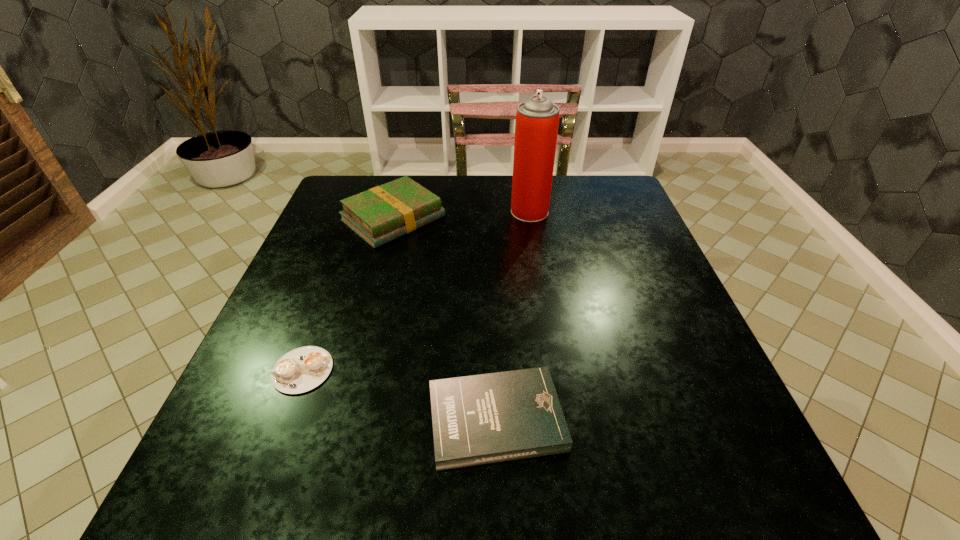
Locate an element on the screen. aerosol can present at the far edge is located at coordinates (537, 119).

Image resolution: width=960 pixels, height=540 pixels. In order to click on book that is at the far edge in this screenshot , I will do `click(379, 215)`.

The image size is (960, 540). What are the coordinates of `object that is at the near edge` in the screenshot? It's located at (480, 419).

Locate an element on the screen. The image size is (960, 540). book positioned at the left edge is located at coordinates (379, 215).

You are a GUI agent. You are given a task and a screenshot of the screen. Output one action in this format:
    pyautogui.click(x=<x>, y=<y>)
    Task: Click on the cappuccino that is positioned at the left edge
    
    Given the screenshot: What is the action you would take?
    pyautogui.click(x=302, y=369)

The image size is (960, 540). Find the location of `object located at the far left corner`. object located at the far left corner is located at coordinates (379, 215).

You are a GUI agent. You are given a task and a screenshot of the screen. Output one action in this format:
    pyautogui.click(x=<x>, y=<y>)
    Task: Click on the vacant position at the far edge of the desktop
    Image resolution: width=960 pixels, height=540 pixels.
    Given the screenshot: What is the action you would take?
    pyautogui.click(x=479, y=181)

In the image, there is a desktop. Identify the location of vacant area at the left edge. (293, 333).

Image resolution: width=960 pixels, height=540 pixels. In order to click on blank area at the right edge in this screenshot , I will do `click(675, 349)`.

This screenshot has width=960, height=540. Identify the location of free space at the far right corner. (593, 211).